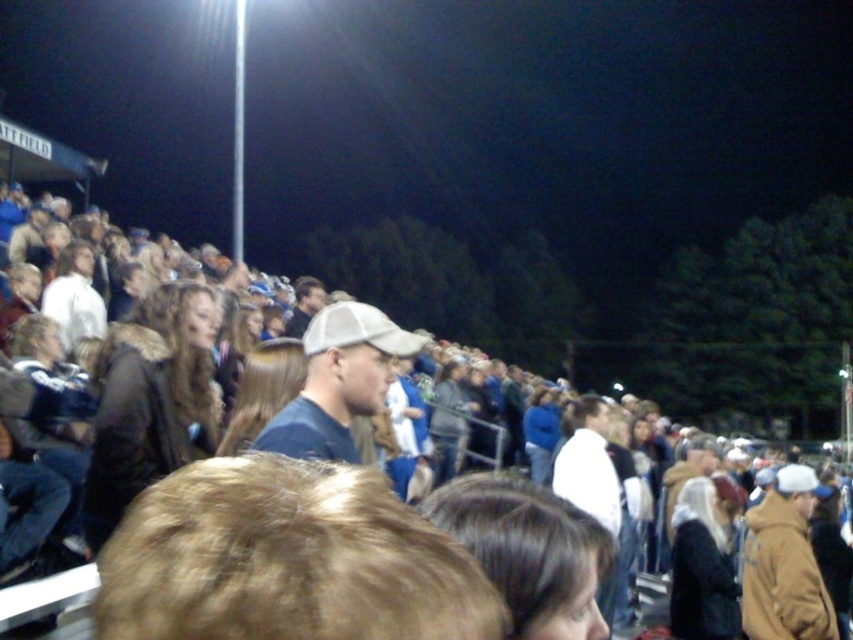
You are at a night sports event and see two people wearing brown jackets. One is wearing a brown fabric jacket at center and the other a brown fuzzy jacket at right. Which person is positioned more to the left?

The brown fabric jacket at center is positioned more to the left than the brown fuzzy jacket at right.

You are a photographer standing at the front of the bleachers. You want to take a photo of the matte blue shirt at center and the brown fuzzy jacket at right. Can you fit both subjects into your camera frame, which has a maximum width of 3 meters?

The matte blue shirt at center is 2.87 meters away from the brown fuzzy jacket at right. Since the distance between them is less than the camera frame width of 3 meters, both subjects can be captured in a single photo.